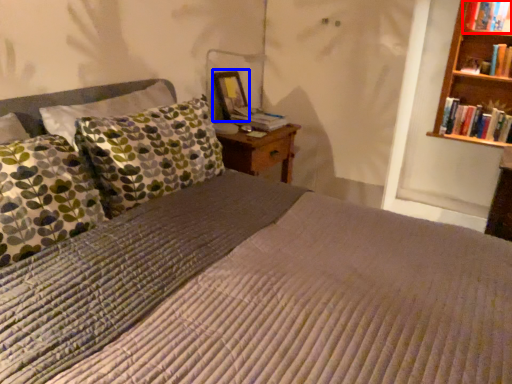
Question: Which object appears farthest to the camera in this image, book (highlighted by a red box) or picture frame (highlighted by a blue box)?

Choices:
 (A) book
 (B) picture frame

Answer: (B)